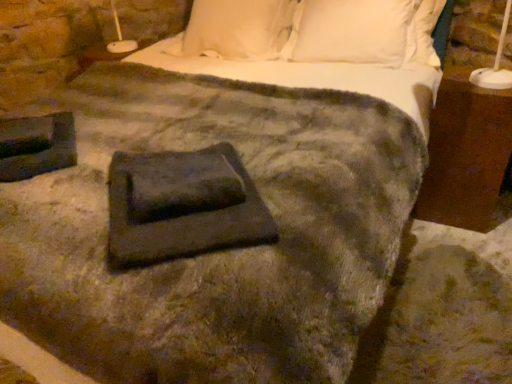
Question: From the image's perspective, does dark gray fabric at center appear higher than brown wood nightstand at right?

Choices:
 (A) yes
 (B) no

Answer: (B)

Question: Is dark gray fabric at center not close to brown wood nightstand at right?

Choices:
 (A) no
 (B) yes

Answer: (B)

Question: Can you confirm if dark gray fabric at center is smaller than brown wood nightstand at right?

Choices:
 (A) yes
 (B) no

Answer: (A)

Question: From a real-world perspective, does dark gray fabric at center sit lower than brown wood nightstand at right?

Choices:
 (A) yes
 (B) no

Answer: (B)

Question: Is dark gray fabric at center positioned behind brown wood nightstand at right?

Choices:
 (A) yes
 (B) no

Answer: (B)

Question: Is dark gray fabric at center closer to the viewer compared to brown wood nightstand at right?

Choices:
 (A) yes
 (B) no

Answer: (A)

Question: From a real-world perspective, is brown wood nightstand at right located beneath dark gray fabric at center?

Choices:
 (A) yes
 (B) no

Answer: (A)

Question: Is brown wood nightstand at right wider than dark gray fabric at center?

Choices:
 (A) no
 (B) yes

Answer: (A)

Question: Is brown wood nightstand at right next to dark gray fabric at center?

Choices:
 (A) yes
 (B) no

Answer: (B)

Question: From the image's perspective, is brown wood nightstand at right located beneath dark gray fabric at center?

Choices:
 (A) yes
 (B) no

Answer: (B)

Question: Considering the relative sizes of brown wood nightstand at right and dark gray fabric at center in the image provided, is brown wood nightstand at right bigger than dark gray fabric at center?

Choices:
 (A) no
 (B) yes

Answer: (B)

Question: Is brown wood nightstand at right further to camera compared to dark gray fabric at center?

Choices:
 (A) no
 (B) yes

Answer: (B)

Question: Is brown wood nightstand at right to the left or to the right of dark gray fabric at center in the image?

Choices:
 (A) right
 (B) left

Answer: (A)